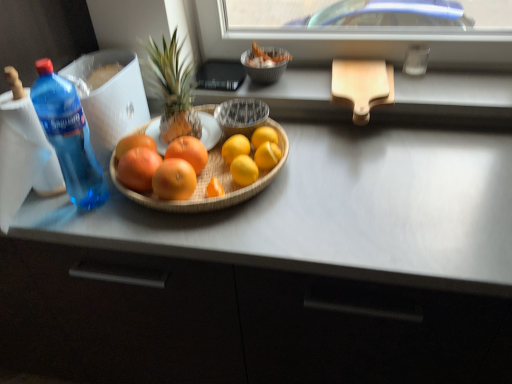
This screenshot has height=384, width=512. Find the location of `vacant space that is to the left of orange matte grapefruit at center, marked as the second grapefruit in a right-to-left arrangement`. vacant space that is to the left of orange matte grapefruit at center, marked as the second grapefruit in a right-to-left arrangement is located at coordinates (98, 199).